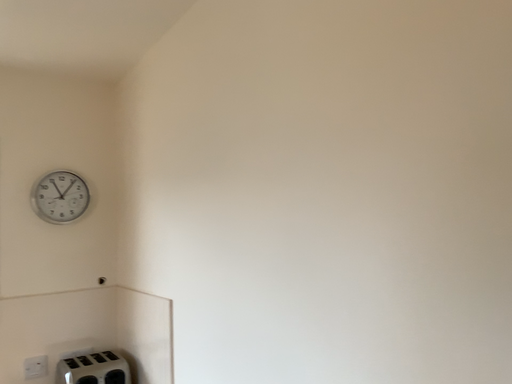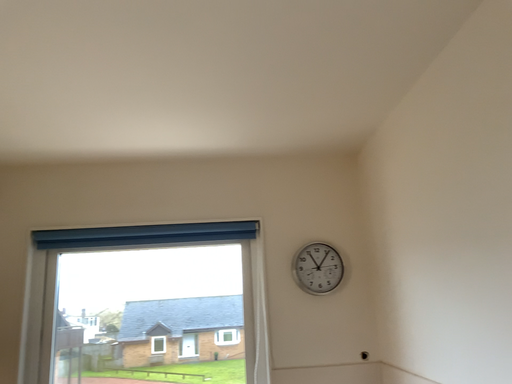
Question: Which way did the camera rotate in the video?

Choices:
 (A) rotated downward
 (B) rotated upward

Answer: (B)